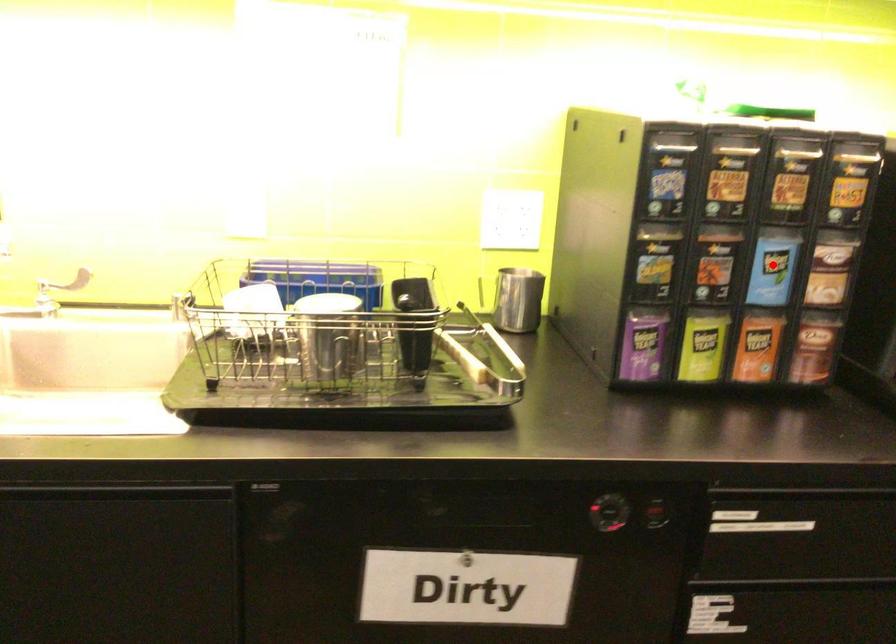
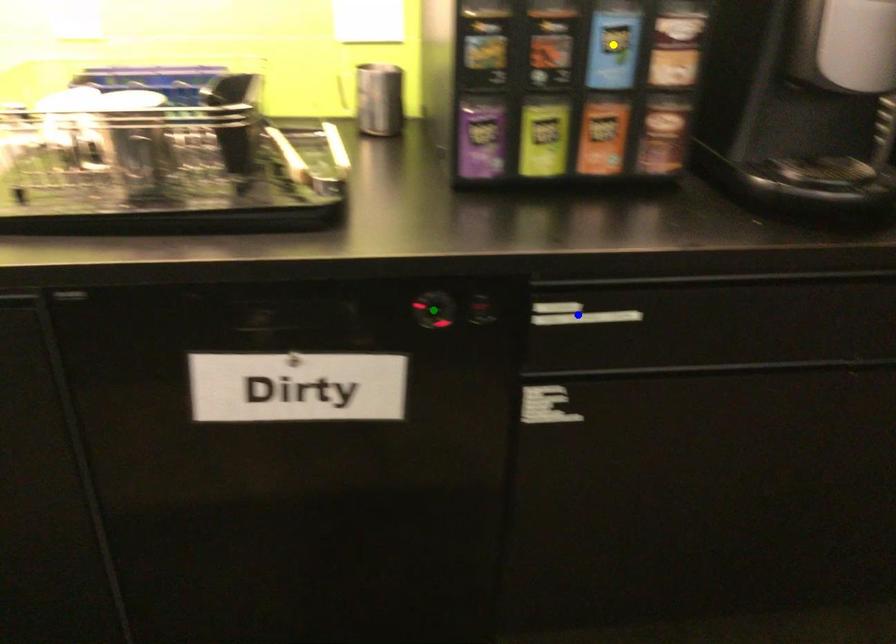
Question: I am providing you with two images of the same scene from different viewpoints. A red point is marked on the first image. You are given multiple points on the second image. Which point in image 2 represents the same 3d spot as the red point in image 1?

Choices:
 (A) blue point
 (B) green point
 (C) yellow point

Answer: (C)